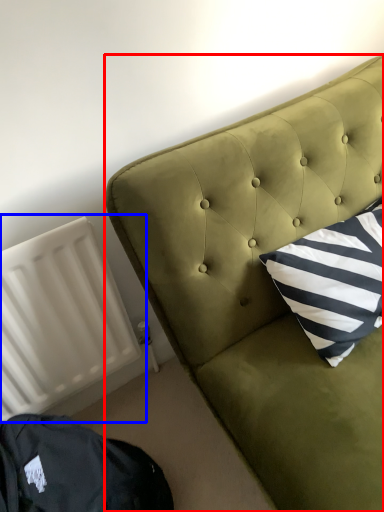
Question: Which object appears closest to the camera in this image, furniture (highlighted by a red box) or radiator (highlighted by a blue box)?

Choices:
 (A) furniture
 (B) radiator

Answer: (A)